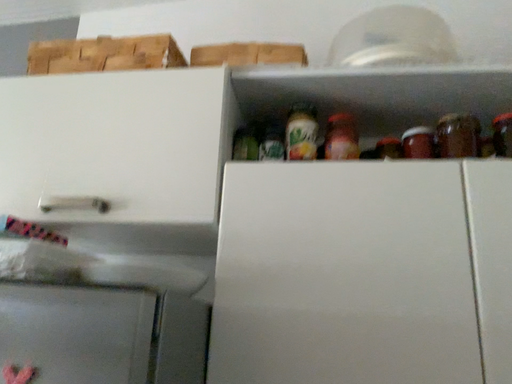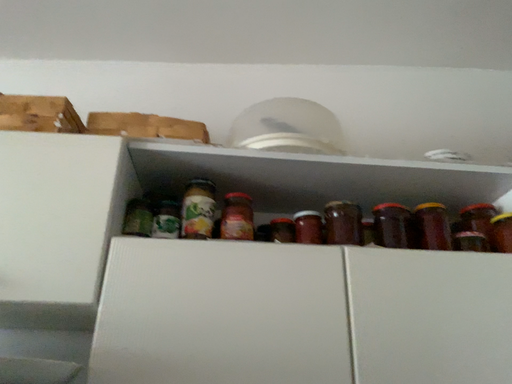
Question: Which way did the camera rotate in the video?

Choices:
 (A) rotated upward
 (B) rotated downward

Answer: (A)